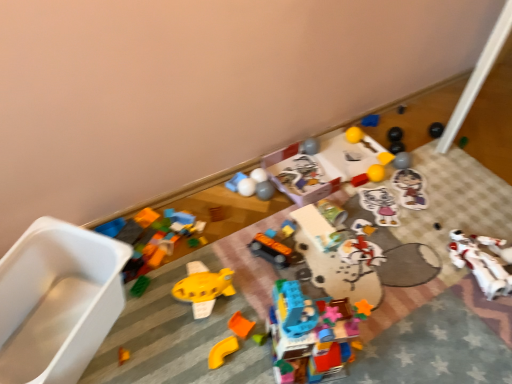
At what (x,y) coordinates should I click in order to perform the action: click on vacant area that lies to the right of matte gray ball at center, which is the 11th toy from right to left. Please return your answer as a coordinate pair (x, y). Image resolution: width=512 pixels, height=384 pixels. Looking at the image, I should click on (303, 198).